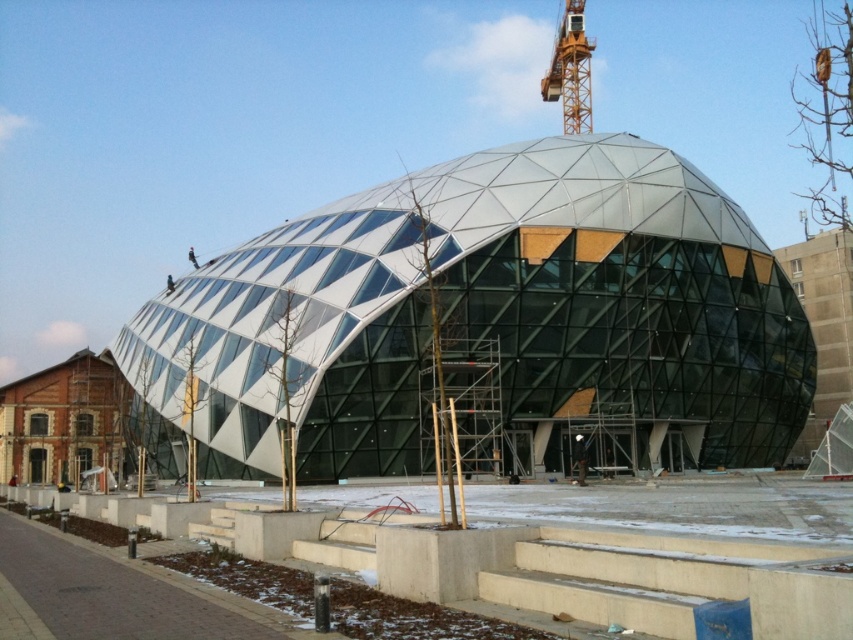
Does concrete steps at center lie behind orange metallic crane at upper center?

No.

Can you confirm if concrete steps at center is taller than orange metallic crane at upper center?

No.

Who is more forward, (341, 490) or (552, 90)?

Point (341, 490) is more forward.

The image size is (853, 640). In order to click on concrete steps at center in this screenshot , I will do `click(589, 550)`.

Does metallic glass dome at center have a smaller size compared to concrete steps at center?

No.

Is point (303, 225) positioned in front of point (253, 502)?

No, (303, 225) is behind (253, 502).

The height and width of the screenshot is (640, 853). What are the coordinates of `metallic glass dome at center` in the screenshot? It's located at (488, 321).

Does metallic glass dome at center have a greater width compared to orange metallic crane at upper center?

Yes.

In the scene shown: Between metallic glass dome at center and orange metallic crane at upper center, which one is positioned lower?

Positioned lower is metallic glass dome at center.

Is point (547, 307) farther from camera compared to point (564, 124)?

No, it is in front of (564, 124).

Identify the location of metallic glass dome at center. Image resolution: width=853 pixels, height=640 pixels. (488, 321).